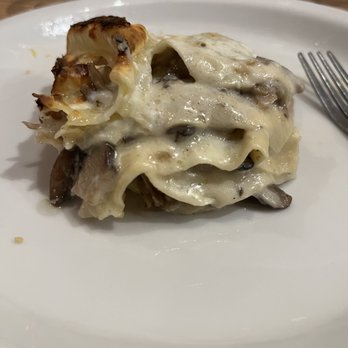
Where is `white plate to left of food`? white plate to left of food is located at coordinates (11, 149).